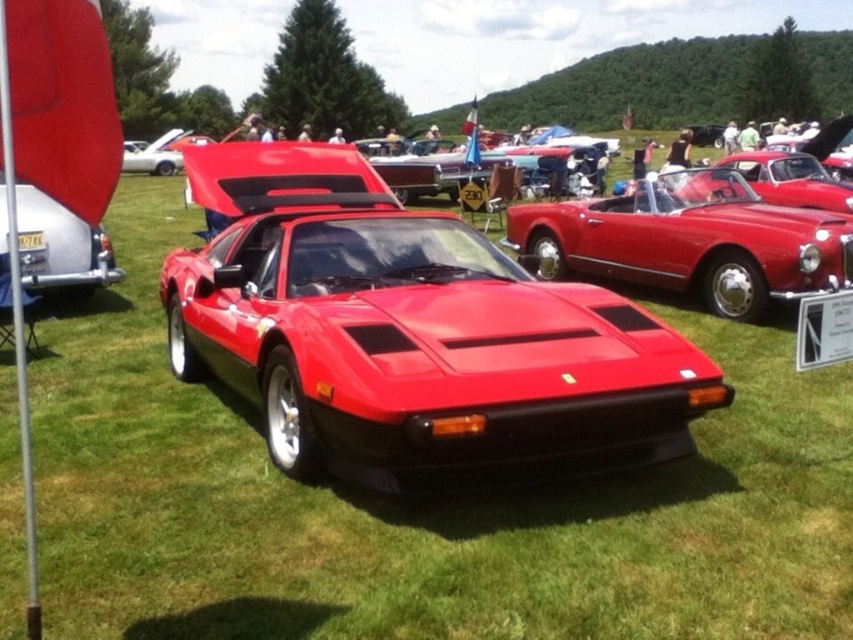
You are standing at the camera position and want to place a 3.5 meters long banner between you and the point at coordinates point (613, 387). Will the banner fit without overlapping the point?

The distance between you and the point (613, 387) is 2.91 meters. Since the banner is 3.5 meters long, it will extend beyond the point, overlapping it by 0.59 meters.

You are standing at the car show and want to take a photo of the shiny red sports car at center. If your camera has a maximum focus range of 2.5 meters, will you need to move closer to get a clear shot?

The shiny red sports car at center is 2.66 meters away from viewer. Since the camera can only focus up to 2.5 meters, you need to move closer to ensure the car is within the focus range.

You are a photographer planning to take a photo of the shiny red sports car at center and the metallic silver license plate at left. Since you want both objects to be in focus, you need to know their height difference. Can you tell me which one is taller?

The shiny red sports car at center is taller than the metallic silver license plate at left.